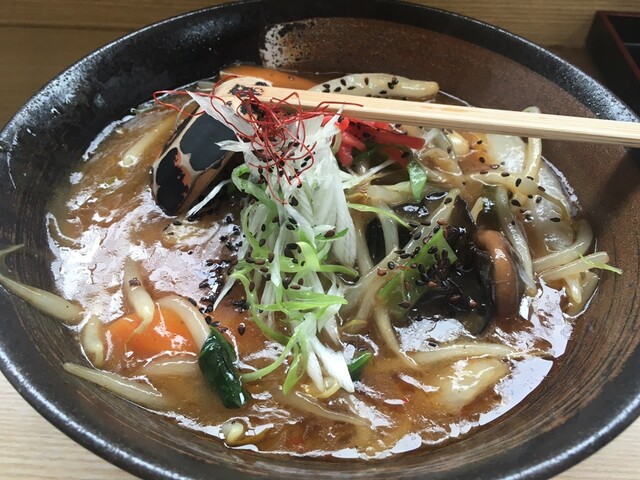
The width and height of the screenshot is (640, 480). What are the coordinates of `table` in the screenshot? It's located at (620, 463), (11, 458), (32, 58).